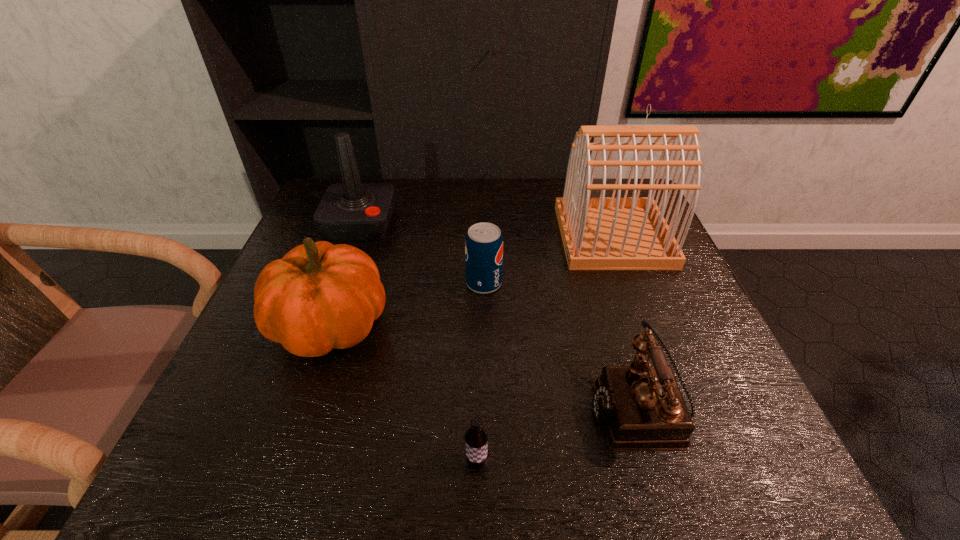
Locate which object is the third closest to the pumpkin. Please provide its 2D coordinates. Your answer should be formatted as a tuple, i.e. [(x, y)], where the tuple contains the x and y coordinates of a point satisfying the conditions above.

[(476, 437)]

Where is `vacant area that satisfies the following two spatial constraints: 1. on the front side of the joystick; 2. on the right side of the pop`? The height and width of the screenshot is (540, 960). vacant area that satisfies the following two spatial constraints: 1. on the front side of the joystick; 2. on the right side of the pop is located at coordinates (340, 284).